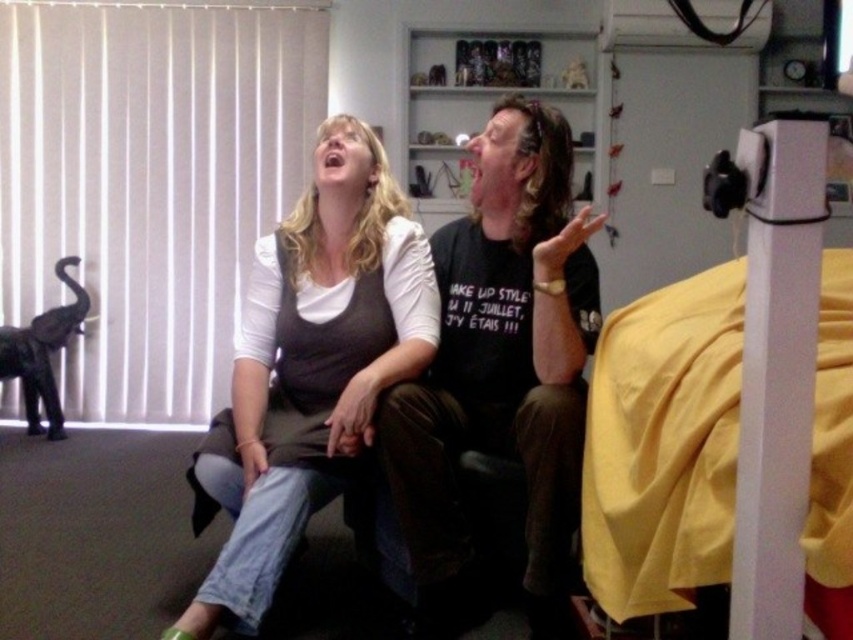
Question: Does black cotton t-shirt at center have a larger size compared to matte brown vest at center?

Choices:
 (A) no
 (B) yes

Answer: (A)

Question: Is yellow fabric bed at right bigger than matte brown vest at center?

Choices:
 (A) no
 (B) yes

Answer: (A)

Question: Considering the real-world distances, which object is farthest from the yellow fabric bed at right?

Choices:
 (A) black cotton t-shirt at center
 (B) matte brown vest at center

Answer: (B)

Question: From the image, what is the correct spatial relationship of yellow fabric bed at right in relation to black cotton t-shirt at center?

Choices:
 (A) right
 (B) left

Answer: (A)

Question: Which point is farther from the camera taking this photo?

Choices:
 (A) (286, 268)
 (B) (799, 520)

Answer: (A)

Question: Among these objects, which one is farthest from the camera?

Choices:
 (A) yellow fabric bed at right
 (B) black cotton t-shirt at center

Answer: (B)